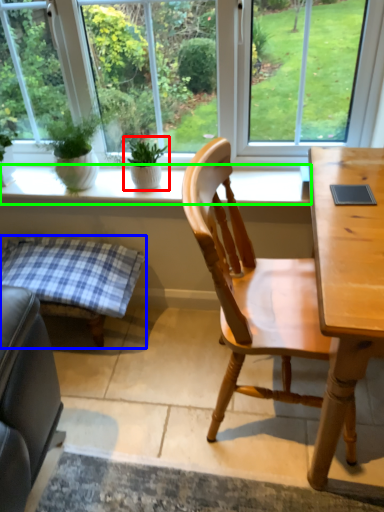
Question: Which is nearer to the houseplant (highlighted by a red box)? table (highlighted by a blue box) or window sill (highlighted by a green box).

Choices:
 (A) table
 (B) window sill

Answer: (B)